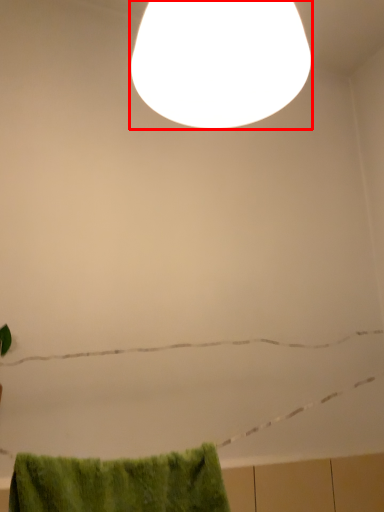
Question: Where is lamp (annotated by the red box) located in relation to bath towel in the image?

Choices:
 (A) right
 (B) left

Answer: (A)